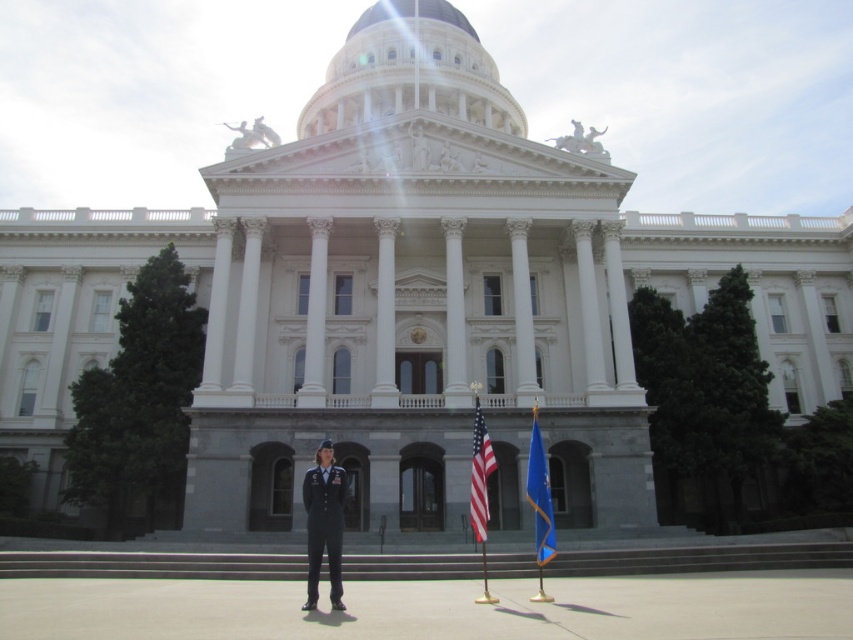
Does dark blue uniform at center have a greater height compared to american flag at center?

No.

Does dark blue uniform at center have a greater width compared to american flag at center?

Yes, dark blue uniform at center is wider than american flag at center.

Does point (311, 536) lie in front of point (469, 484)?

Yes, point (311, 536) is closer to viewer.

Find the location of a particular element. dark blue uniform at center is located at coordinates (323, 522).

Which is more to the left, dark blue uniform at center or blue fabric flag at center?

dark blue uniform at center is more to the left.

Which is below, dark blue uniform at center or blue fabric flag at center?

dark blue uniform at center is below.

At what (x,y) coordinates should I click in order to perform the action: click on dark blue uniform at center. Please return your answer as a coordinate pair (x, y). This screenshot has width=853, height=640. Looking at the image, I should click on (323, 522).

Locate an element on the screen. blue fabric flag at center is located at coordinates [x=540, y=496].

In the scene shown: Who is more forward, (534, 483) or (480, 483)?

Positioned in front is point (480, 483).

The width and height of the screenshot is (853, 640). Find the location of `blue fabric flag at center`. blue fabric flag at center is located at coordinates (540, 496).